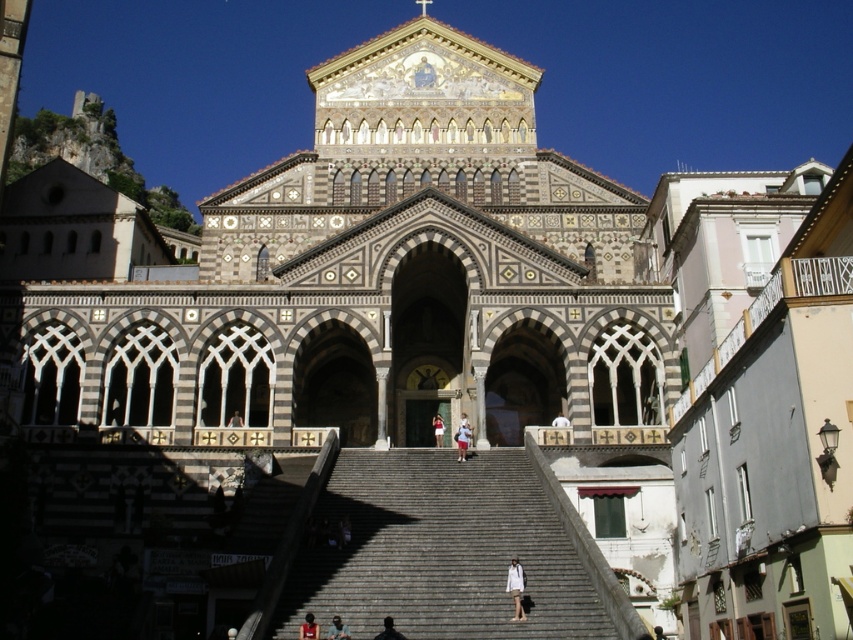
Question: Is white cotton shirt at center further to camera compared to dark blue fabric at center?

Choices:
 (A) no
 (B) yes

Answer: (B)

Question: From the image, what is the correct spatial relationship of gray stone stairs at center in relation to dark brown hair at center?

Choices:
 (A) below
 (B) above

Answer: (B)

Question: Which object is farther from the camera taking this photo?

Choices:
 (A) dark brown hair at center
 (B) dark blue fabric at center
 (C) dark brown leather jacket at center
 (D) light beige cotton shirt at center

Answer: (D)

Question: Observing the image, what is the correct spatial positioning of dark brown leather jacket at center in reference to dark blue fabric at center?

Choices:
 (A) above
 (B) below

Answer: (A)

Question: Which is nearer to the white cotton dress at center?

Choices:
 (A) light beige cotton shirt at center
 (B) dark brown wooden chair at center
 (C) dark blue fabric at center
 (D) white cotton shirt at center

Answer: (D)

Question: Based on their relative distances, which object is nearer to the white cotton shirt at center?

Choices:
 (A) light beige cotton shirt at center
 (B) gray stone stairs at center
 (C) dark blue fabric at center
 (D) dark brown wooden chair at center

Answer: (B)